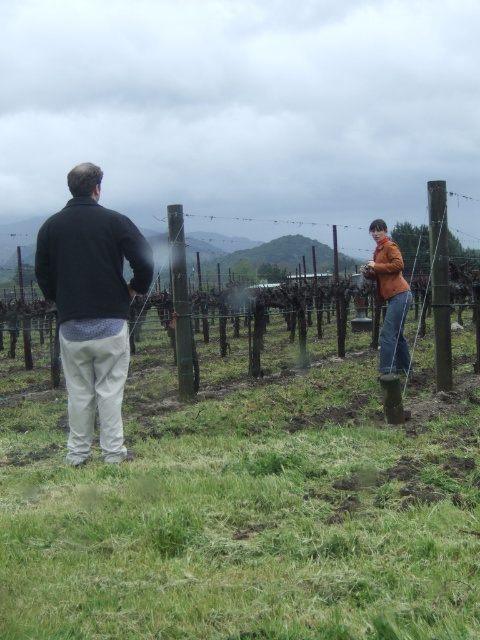
You are a photographer trying to capture both the dark gray sweater at left and the orange leather jacket at right in a single frame. Which person should you position closer to the camera to ensure both are fully visible?

The orange leather jacket at right should be positioned closer to the camera because the dark gray sweater at left is taller than the orange leather jacket at right, so bringing the shorter person forward will help balance their visibility in the photo.

Consider the image. You are standing at the point marked as point (440,282) in the image. What object are you touching?

The point (440,282) is on the brown wooden post at right, so you are touching the brown wooden post at right.